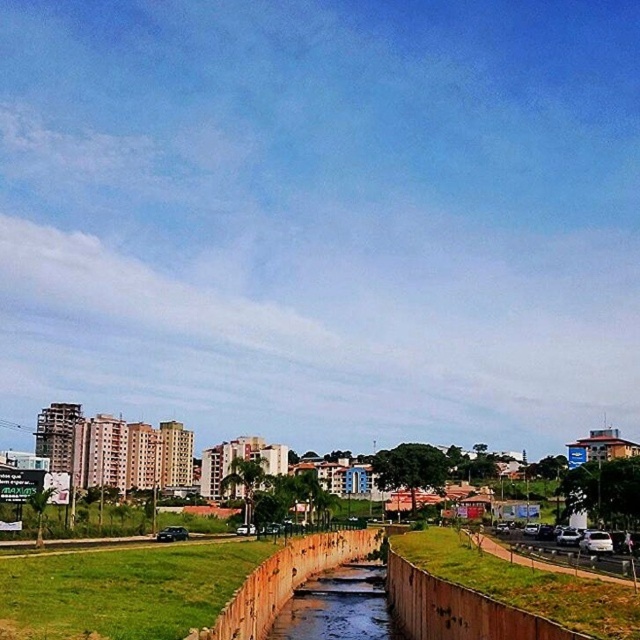
Question: Which object appears farthest from the camera in this image?

Choices:
 (A) brown concrete river at center
 (B) green grass at lower left

Answer: (A)

Question: Is green grass at lower left above brown concrete river at center?

Choices:
 (A) no
 (B) yes

Answer: (B)

Question: Which of the following is the closest to the observer?

Choices:
 (A) green grass at lower left
 (B) brown concrete river at center
 (C) green grass at lower center

Answer: (C)

Question: Does green grass at lower left appear under green grass at lower center?

Choices:
 (A) no
 (B) yes

Answer: (A)

Question: Is green grass at lower left to the right of green grass at lower center from the viewer's perspective?

Choices:
 (A) yes
 (B) no

Answer: (B)

Question: Which object is farther from the camera taking this photo?

Choices:
 (A) green grass at lower center
 (B) brown concrete river at center

Answer: (B)